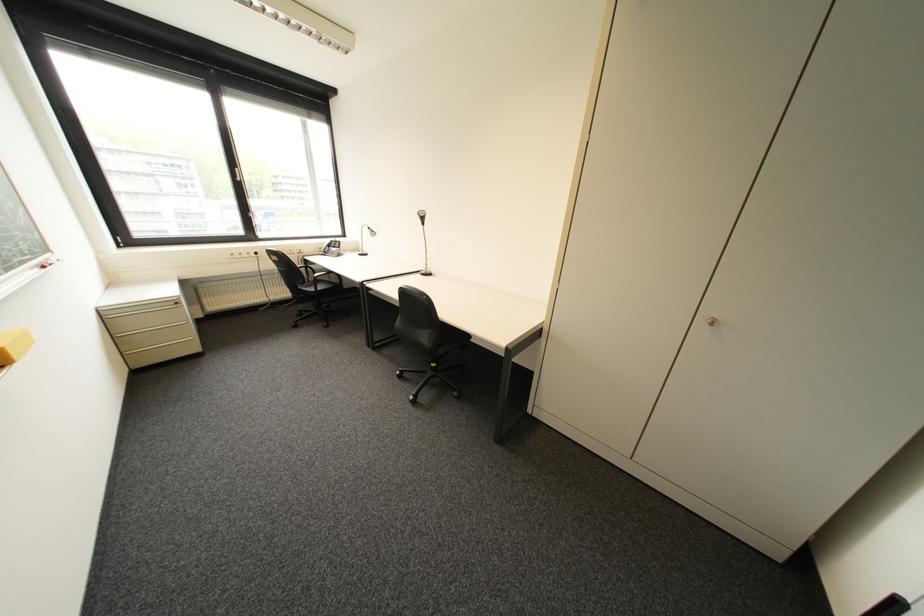
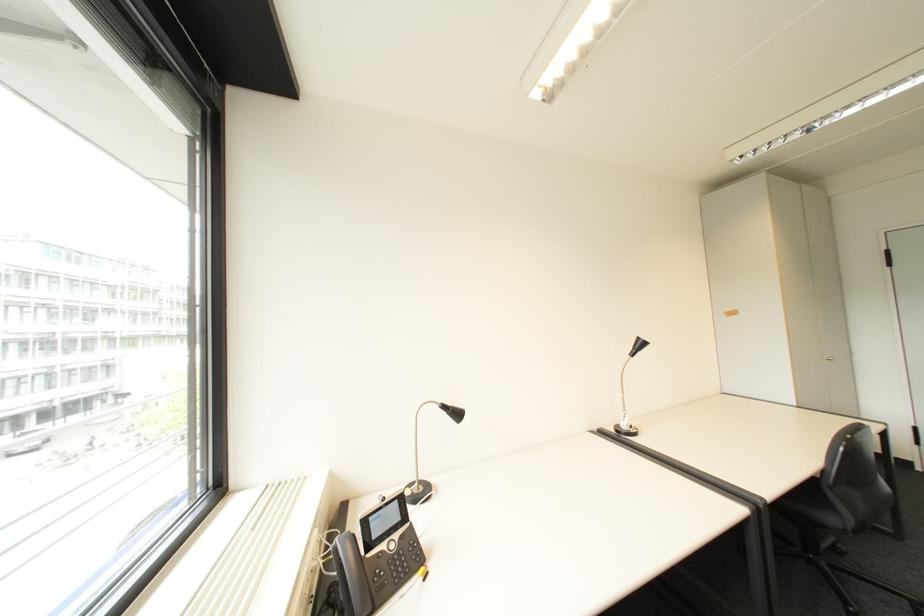
In the second image, find the point that corresponds to point (380, 229) in the first image.

(455, 407)